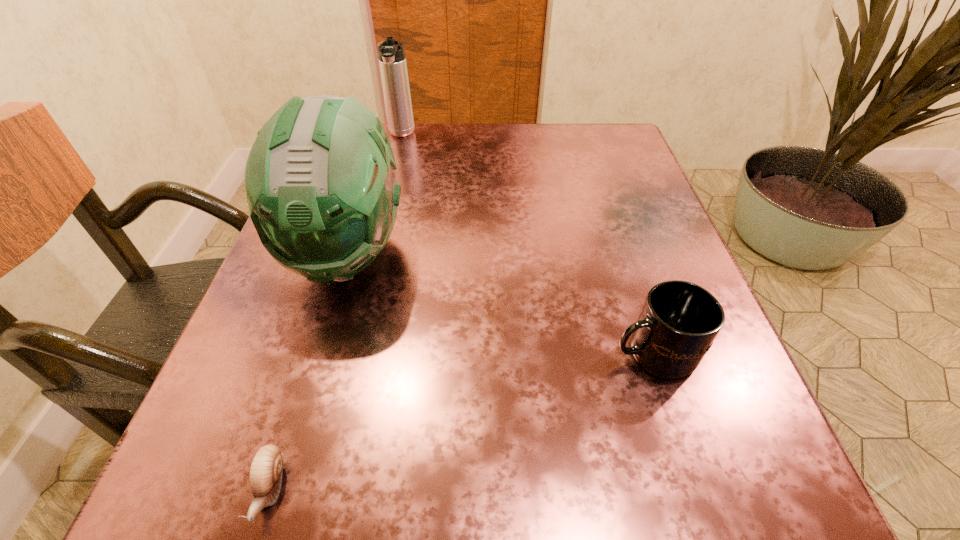
This screenshot has height=540, width=960. I want to click on object at the near left corner, so click(x=266, y=468).

The image size is (960, 540). In the image, there is a desktop. In order to click on free space at the far edge in this screenshot , I will do `click(456, 127)`.

Locate an element on the screen. blank space at the left edge of the desktop is located at coordinates 331,293.

You are a GUI agent. You are given a task and a screenshot of the screen. Output one action in this format:
    pyautogui.click(x=<x>, y=<y>)
    Task: Click on the free region at the right edge of the desktop
    The height and width of the screenshot is (540, 960).
    Given the screenshot: What is the action you would take?
    pyautogui.click(x=598, y=239)

At what (x,y) coordinates should I click in order to perform the action: click on free spot at the near left corner of the desktop. Please return your answer as a coordinate pair (x, y). The width and height of the screenshot is (960, 540). Looking at the image, I should click on (285, 489).

In the image, there is a desktop. Where is `vacant region at the far right corner`? Image resolution: width=960 pixels, height=540 pixels. vacant region at the far right corner is located at coordinates (565, 130).

The image size is (960, 540). In order to click on free space at the near right corner of the desktop in this screenshot , I will do `click(807, 534)`.

I want to click on free space between the second farthest object and the shortest object, so click(309, 371).

At what (x,y) coordinates should I click in order to perform the action: click on free spot between the second tallest object and the second nearest object. Please return your answer as a coordinate pair (x, y). This screenshot has height=540, width=960. Looking at the image, I should click on (527, 244).

At what (x,y) coordinates should I click in order to perform the action: click on free space between the second tallest object and the mug. Please return your answer as a coordinate pair (x, y). Looking at the image, I should click on (527, 244).